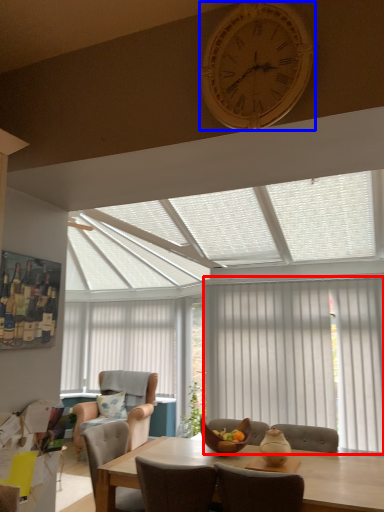
Question: Which object appears closest to the camera in this image, curtain (highlighted by a red box) or clock (highlighted by a blue box)?

Choices:
 (A) curtain
 (B) clock

Answer: (B)